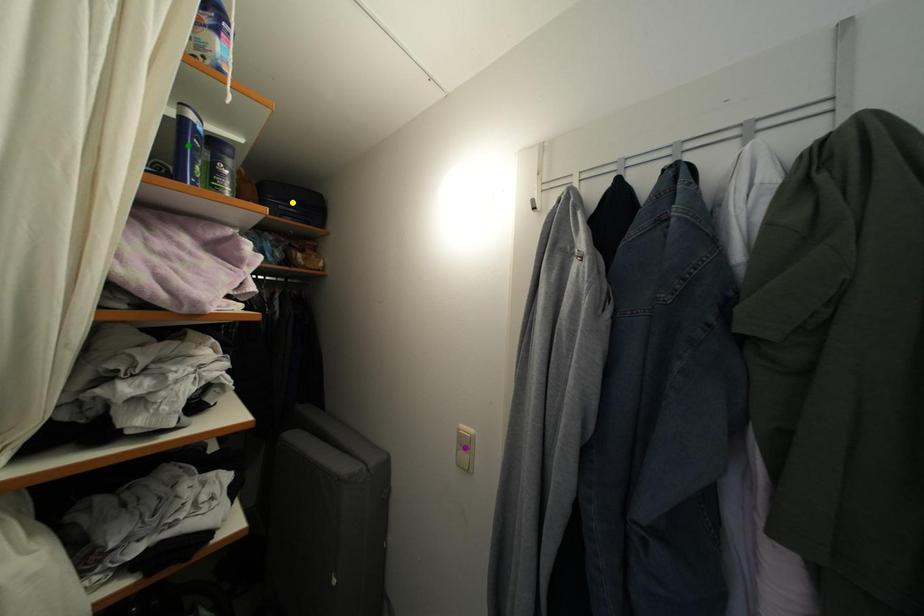
Order these from farthest to nearest:
yellow point | purple point | green point

yellow point, purple point, green point